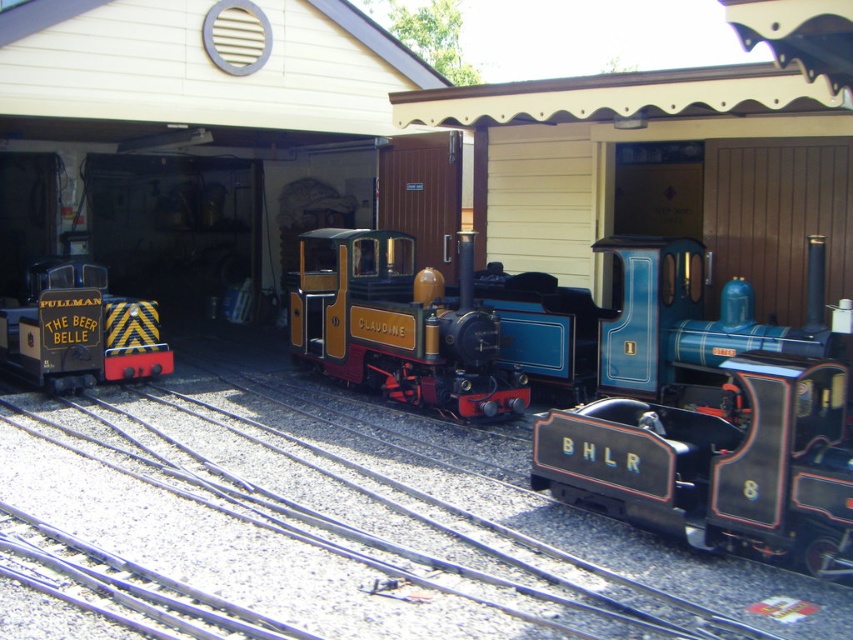
Does black polished wood train at center have a larger size compared to gold polished metal claudine at center?

No, black polished wood train at center is not bigger than gold polished metal claudine at center.

Between black polished wood train at center and gold polished metal claudine at center, which one is positioned lower?

black polished wood train at center is below.

Who is more forward, (814, 544) or (515, 387)?

Positioned in front is point (814, 544).

At what (x,y) coordinates should I click in order to perform the action: click on black polished wood train at center. Please return your answer as a coordinate pair (x, y). The height and width of the screenshot is (640, 853). Looking at the image, I should click on (718, 465).

Can you confirm if black polished wood train at center is smaller than yellow and black striped train at left?

Yes.

Can you confirm if black polished wood train at center is shorter than yellow and black striped train at left?

Indeed, black polished wood train at center has a lesser height compared to yellow and black striped train at left.

Does point (814, 435) come behind point (142, 330)?

No, it is not.

Find the location of a particular element. black polished wood train at center is located at coordinates (718, 465).

Can you confirm if gold polished metal claudine at center is taller than yellow and black striped train at left?

Yes.

Is gold polished metal claudine at center smaller than yellow and black striped train at left?

No, gold polished metal claudine at center is not smaller than yellow and black striped train at left.

Is point (316, 256) closer to camera compared to point (42, 346)?

That is False.

Locate an element on the screen. gold polished metal claudine at center is located at coordinates pos(396,326).